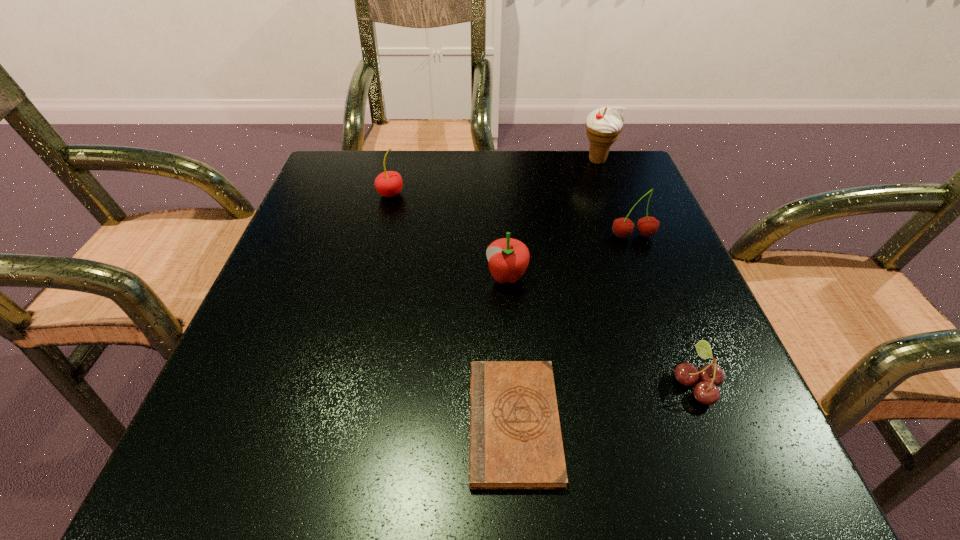
In the image, there is a desktop. Where is `vacant space at the right edge`? This screenshot has height=540, width=960. vacant space at the right edge is located at coordinates (634, 215).

Locate an element on the screen. The width and height of the screenshot is (960, 540). vacant space at the far left corner of the desktop is located at coordinates (381, 163).

This screenshot has width=960, height=540. In order to click on vacant position at the near left corner of the desktop in this screenshot , I will do `click(266, 441)`.

In order to click on blank space at the far right corner of the desktop in this screenshot , I will do `click(645, 208)`.

This screenshot has width=960, height=540. In the image, there is a desktop. In order to click on vacant region at the near right corner in this screenshot , I will do `click(748, 495)`.

Locate an element on the screen. The height and width of the screenshot is (540, 960). vacant area that lies between the fourth tallest object and the second farthest object is located at coordinates (448, 235).

Identify the location of vacant area that lies between the shortest object and the fourth nearest object. The height and width of the screenshot is (540, 960). tap(573, 329).

Image resolution: width=960 pixels, height=540 pixels. In order to click on vacant space that is in between the second shortest object and the diary in this screenshot , I will do `click(605, 403)`.

You are a GUI agent. You are given a task and a screenshot of the screen. Output one action in this format:
    pyautogui.click(x=<x>, y=<y>)
    Task: Click on the empty space that is in between the farthest cherry and the shortest object
    The height and width of the screenshot is (540, 960).
    Given the screenshot: What is the action you would take?
    pyautogui.click(x=452, y=308)

What are the coordinates of `vacant area that lies between the fifth nearest object and the nearest cherry` in the screenshot? It's located at (543, 289).